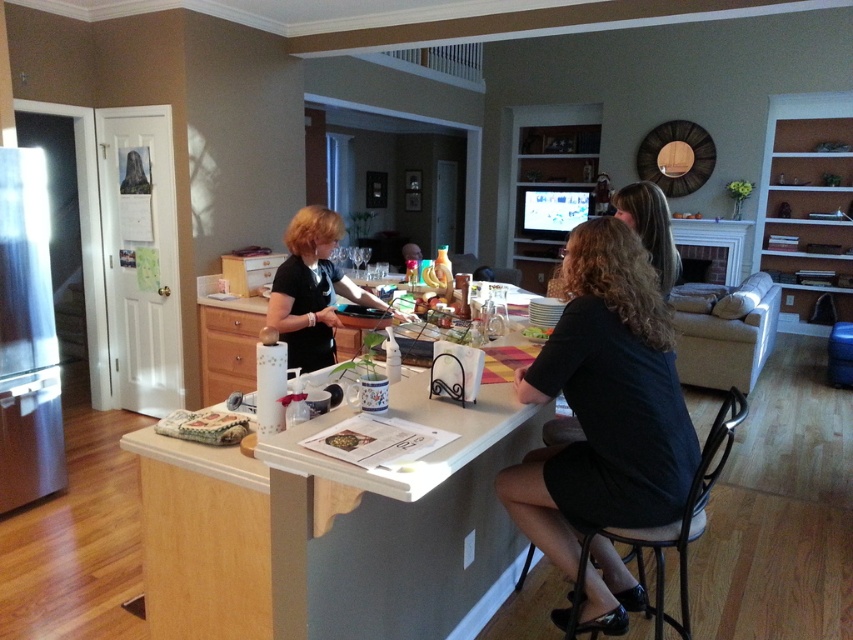
You are a delivery robot that needs to place a package between the black fabric shirt at center and the blonde hair at center. The package is 24 inches long. Can you fit it in the space between them?

The distance between the black fabric shirt at center and the blonde hair at center is 23.53 inches. Since the package is 24 inches long, it is slightly longer than the available space. Therefore, the package cannot fit between them.

You are standing in the living room and want to sit down on the beige fabric couch at right. Which direction should you walk to reach it?

The beige fabric couch at right is located at point (727, 336), so you should walk towards the right side of the room to reach it.

What are the coordinates of the black fabric shirt at center?

The coordinates of the black fabric shirt at center are at point (604, 403).